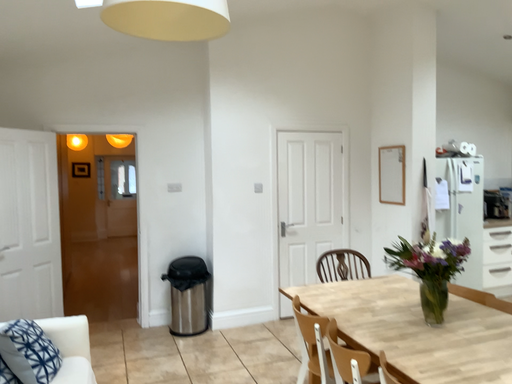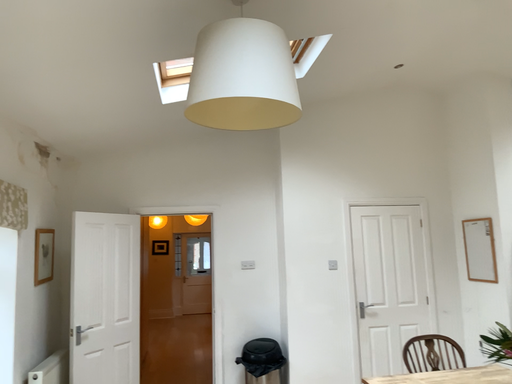
Question: How did the camera likely rotate when shooting the video?

Choices:
 (A) rotated downward
 (B) rotated upward

Answer: (B)